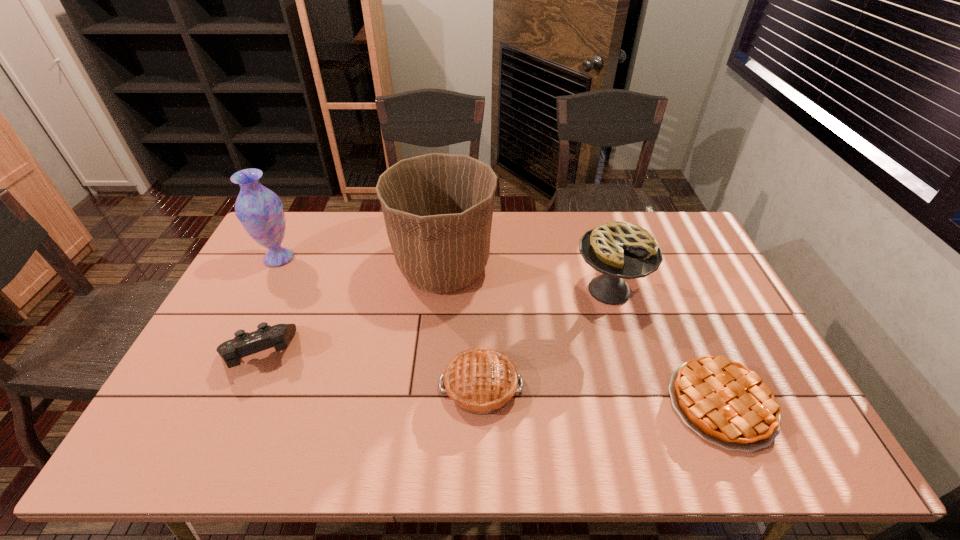
This screenshot has width=960, height=540. I want to click on blank space located 0.220m on the cut side of the farthest pie, so click(637, 382).

In order to click on vacant space situated 0.360m on the right of the fourth tallest object in this screenshot , I will do `click(426, 353)`.

The image size is (960, 540). I want to click on vacant region located 0.070m on the left of the second shortest object, so click(412, 386).

Identify the location of vacant space located on the back of the shortest pie. This screenshot has width=960, height=540. (676, 303).

Find the location of a particular element. The width and height of the screenshot is (960, 540). flowerpot located at the far edge is located at coordinates pos(438,208).

Where is `vase located at the far edge`? The height and width of the screenshot is (540, 960). vase located at the far edge is located at coordinates (260, 211).

The image size is (960, 540). In order to click on object present at the near edge in this screenshot , I will do `click(725, 403)`.

Locate an element on the screen. Image resolution: width=960 pixels, height=540 pixels. vase positioned at the left edge is located at coordinates point(260,211).

The image size is (960, 540). What are the coordinates of `control that is at the left edge` in the screenshot? It's located at pyautogui.click(x=244, y=344).

Locate an element on the screen. The image size is (960, 540). object present at the right edge is located at coordinates (725, 403).